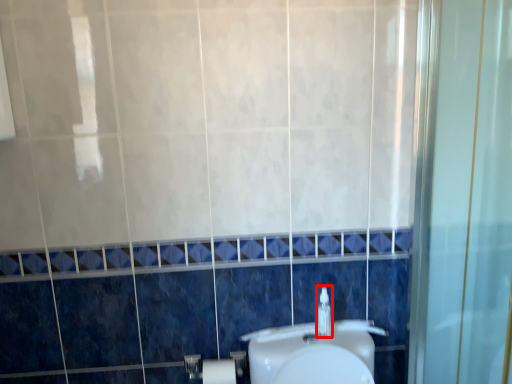
Question: From the image's perspective, where is soap dispenser (annotated by the red box) located relative to toilet paper?

Choices:
 (A) below
 (B) above

Answer: (B)